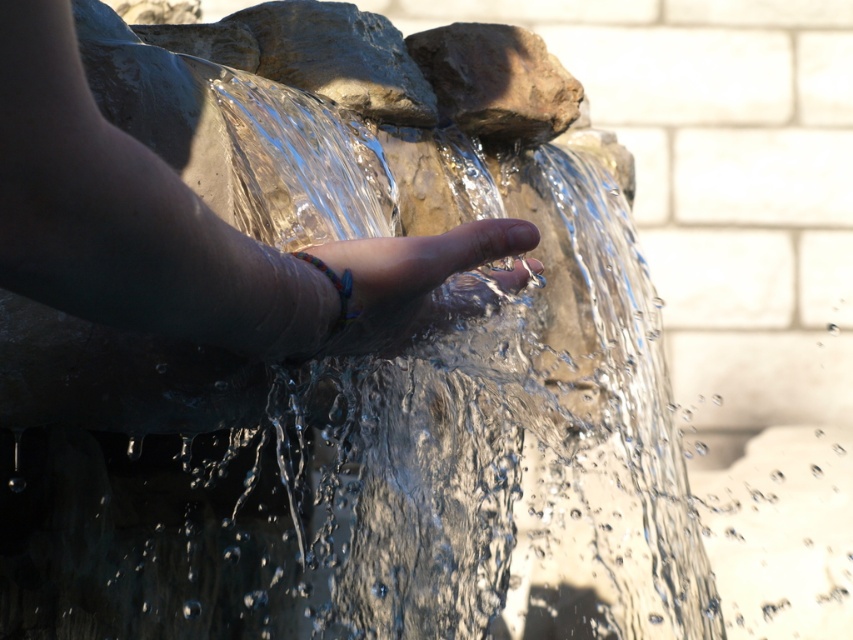
Question: Does multicolored beaded bracelet at center have a greater width compared to rough stone at center?

Choices:
 (A) no
 (B) yes

Answer: (A)

Question: Which object is positioned farthest from the smooth skin hand at center?

Choices:
 (A) multicolored beaded bracelet at center
 (B) rough stone at center

Answer: (B)

Question: Which of the following is the closest to the observer?

Choices:
 (A) (512, 100)
 (B) (62, 4)
 (C) (436, 305)

Answer: (B)

Question: Which point is farther to the camera?

Choices:
 (A) multicolored beaded bracelet at center
 (B) rough stone at center

Answer: (B)

Question: Where is smooth skin hand at center located in relation to rough stone at center in the image?

Choices:
 (A) below
 (B) above

Answer: (A)

Question: Is smooth skin hand at center wider than multicolored beaded bracelet at center?

Choices:
 (A) no
 (B) yes

Answer: (B)